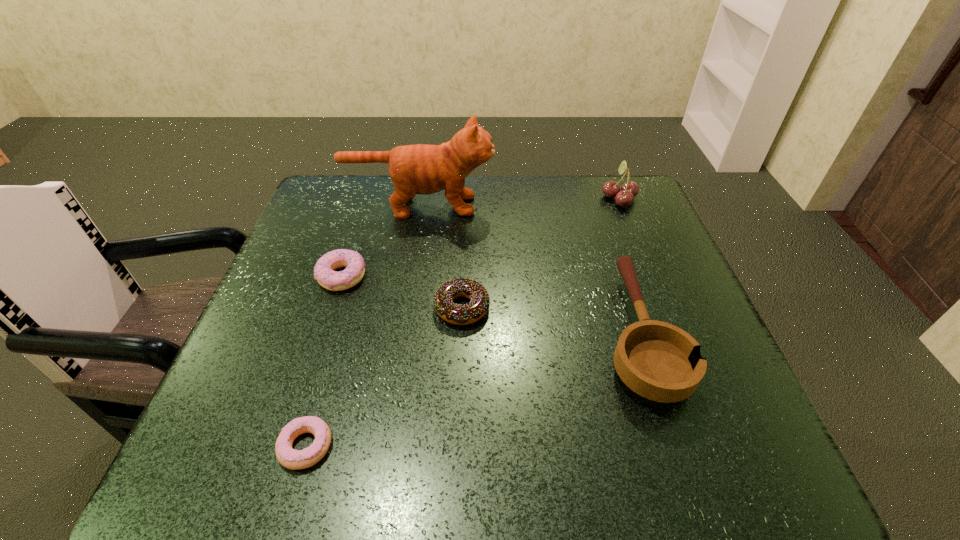
This screenshot has width=960, height=540. In order to click on saucepan that is at the right edge in this screenshot , I will do `click(659, 361)`.

In order to click on object positioned at the far left corner in this screenshot , I will do `click(424, 169)`.

Find the location of `object at the near left corner`. object at the near left corner is located at coordinates (288, 457).

Identify the location of object that is at the far right corner. (624, 197).

The width and height of the screenshot is (960, 540). In order to click on vacant point at the far edge in this screenshot , I will do `click(480, 213)`.

Where is `free spot at the near edge of the desktop`? The image size is (960, 540). free spot at the near edge of the desktop is located at coordinates (x=462, y=472).

Identify the location of vacant region at the left edge of the desktop. (264, 313).

In the image, there is a desktop. Where is `free space at the right edge`? This screenshot has width=960, height=540. free space at the right edge is located at coordinates (601, 229).

The height and width of the screenshot is (540, 960). Find the location of `vacant region at the far left corner of the desktop`. vacant region at the far left corner of the desktop is located at coordinates click(333, 187).

Locate an element on the screen. free region at the near left corner is located at coordinates (178, 480).